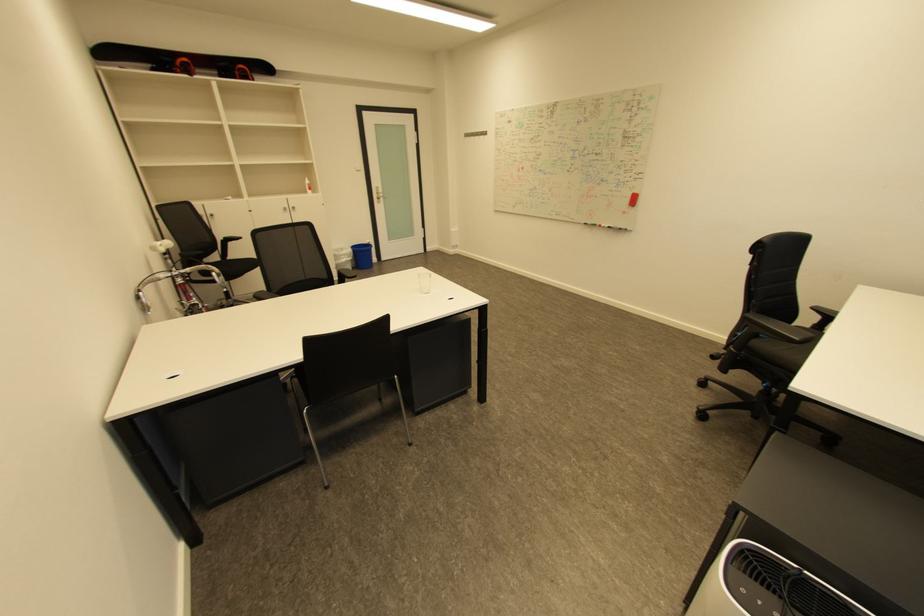
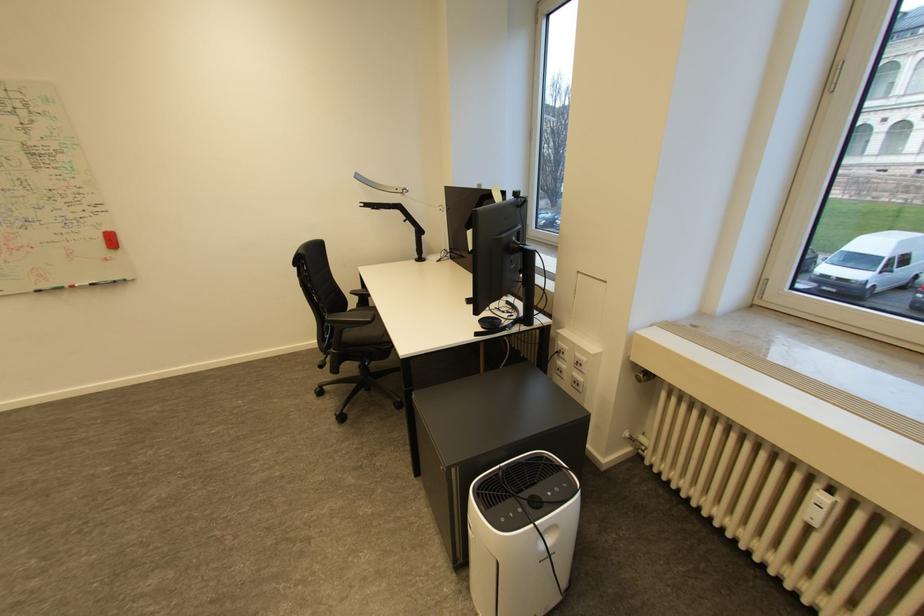
Question: Based on the continuous images, in which direction is the camera rotating? Reply with the corresponding letter.

Choices:
 (A) Left
 (B) Right
 (C) Up
 (D) Down

Answer: (B)